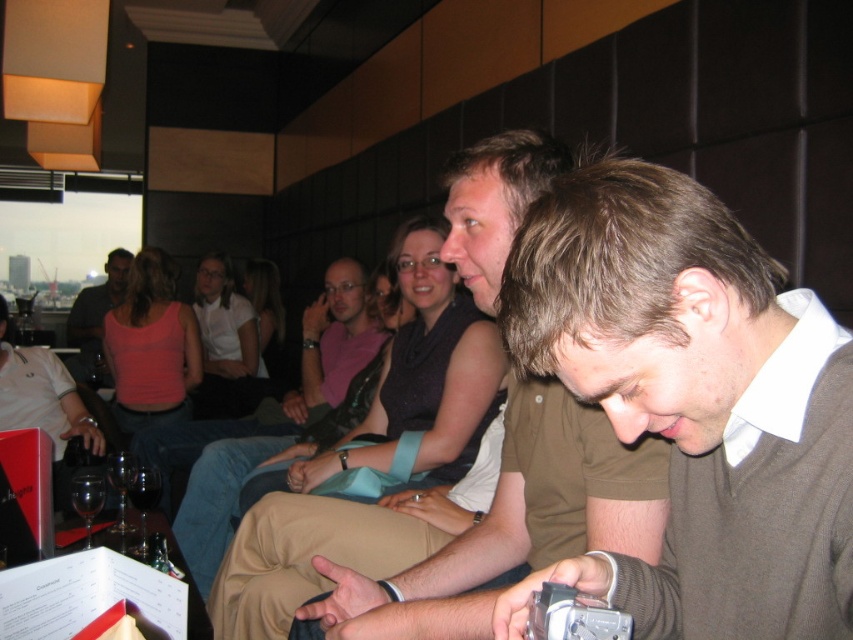
You are a photographer at the event and want to take a photo of the matte white shirt at center and the transparent glass at lower left. Which object should you focus on first if you want to capture both clearly in focus?

The matte white shirt at center is above the transparent glass at lower left, so you should focus on the matte white shirt at center first to ensure both are in focus.

You are a photographer standing at the back of the room. You want to take a photo of the matte white shirt at center and the matte black wine glass at left. If your camera has a minimum focus distance of 5 feet, will you be able to capture both objects clearly in the same frame without moving closer?

The matte white shirt at center is 4.99 feet away from the matte black wine glass at left. Since the distance between them is just under 5 feet, your camera can focus on both objects as they are within the minimum focus distance requirement.

You are a photographer at the event and need to place a 10 cm wide decorative item between the brown sweater at center and the transparent glass at lower left. Can you fit it without overlapping either object?

The brown sweater at center is wider than the transparent glass at lower left. Since the sweater is wider, there might be sufficient space between them to place the 10 cm item, but exact placement depends on their exact positions and spacing.